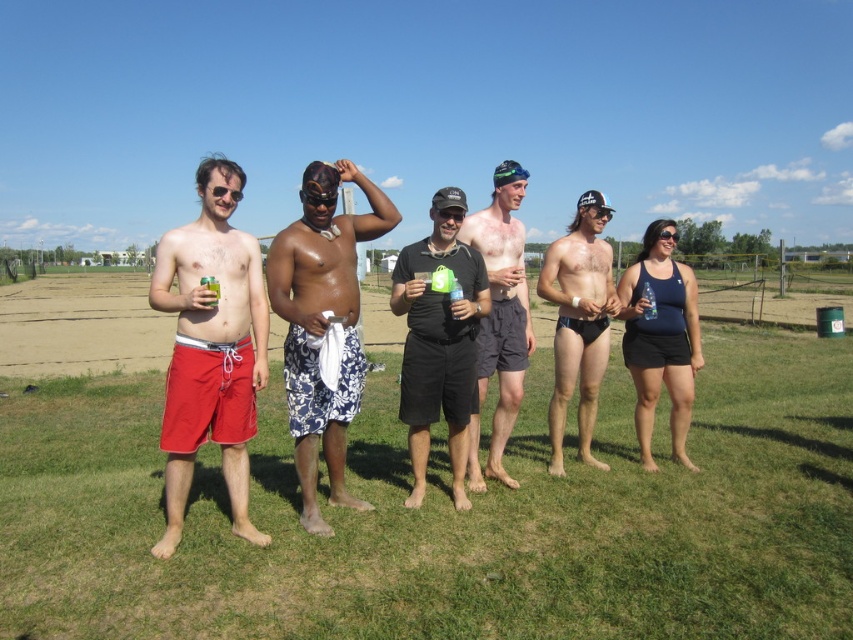
What is the color of the shorts at the point located at coordinates (439, 339)?

The shorts at the point located at coordinates (439, 339) are black.

You are planning to set up a small picnic blanket in the image. The blanket is 1 meter wide. Considering the space between the green grass at center and the matte red shorts at left, will the blanket fit without overlapping any objects?

The green grass at center is wider than the matte red shorts at left. Since the blanket is 1 meter wide, it can fit within the space of the green grass at center as long as it doesn t overlap the matte red shorts at left.